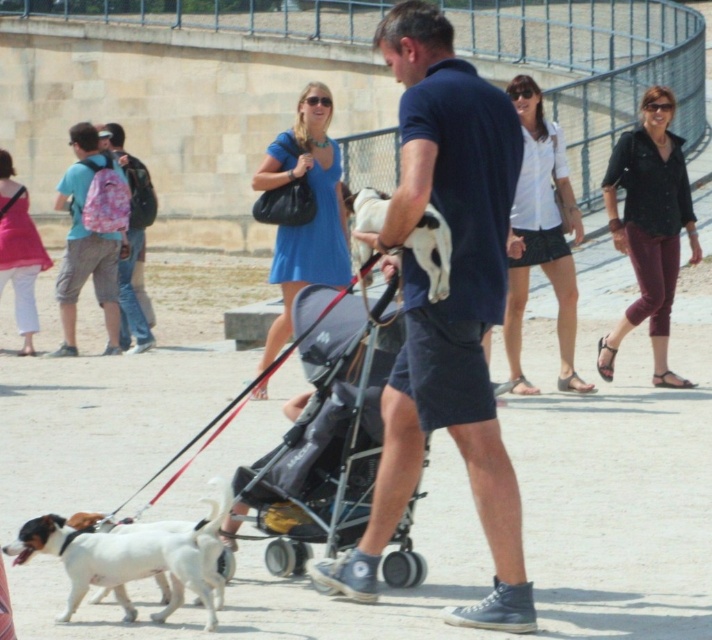
Which is more to the left, dark blue cotton polo shirt at center or white fur dog at lower left?

From the viewer's perspective, white fur dog at lower left appears more on the left side.

Who is taller, dark blue cotton polo shirt at center or white fur dog at lower left?

With more height is dark blue cotton polo shirt at center.

This screenshot has width=712, height=640. In order to click on dark blue cotton polo shirt at center in this screenshot , I will do `click(446, 308)`.

Who is shorter, black fabric stroller at center or pink backpack at left?

black fabric stroller at center is shorter.

Between black fabric stroller at center and pink backpack at left, which one is positioned lower?

black fabric stroller at center

The width and height of the screenshot is (712, 640). I want to click on black fabric stroller at center, so click(x=328, y=445).

Is white fur dog at lower left closer to camera compared to pink fabric backpack at left?

Yes, white fur dog at lower left is closer to the viewer.

Who is more forward, (122, 604) or (103, 285)?

Point (122, 604) is in front.

This screenshot has height=640, width=712. I want to click on white fur dog at lower left, so click(x=120, y=563).